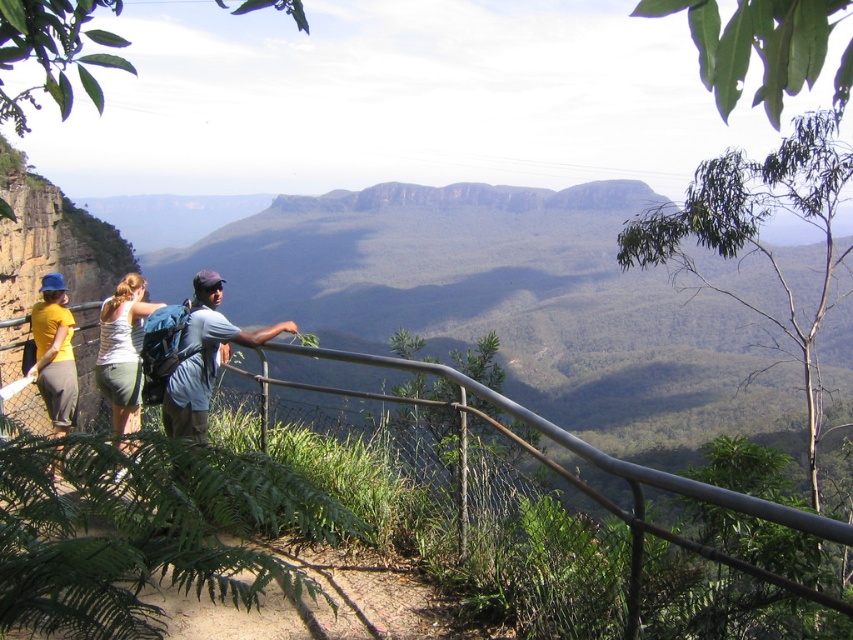
Question: Which is nearer to the white cotton tank top at center?

Choices:
 (A) yellow matte shirt at left
 (B) light blue t-shirt at center

Answer: (A)

Question: Which point is farther to the camera?

Choices:
 (A) light blue t-shirt at center
 (B) yellow matte shirt at left

Answer: (A)

Question: Which object appears farthest from the camera in this image?

Choices:
 (A) light blue t-shirt at center
 (B) metallic gray rail at upper center

Answer: (A)

Question: Is the position of light blue t-shirt at center more distant than that of yellow matte shirt at left?

Choices:
 (A) no
 (B) yes

Answer: (B)

Question: Is light blue t-shirt at center wider than white cotton tank top at center?

Choices:
 (A) yes
 (B) no

Answer: (B)

Question: Can you confirm if white cotton tank top at center is positioned to the left of yellow matte shirt at left?

Choices:
 (A) no
 (B) yes

Answer: (A)